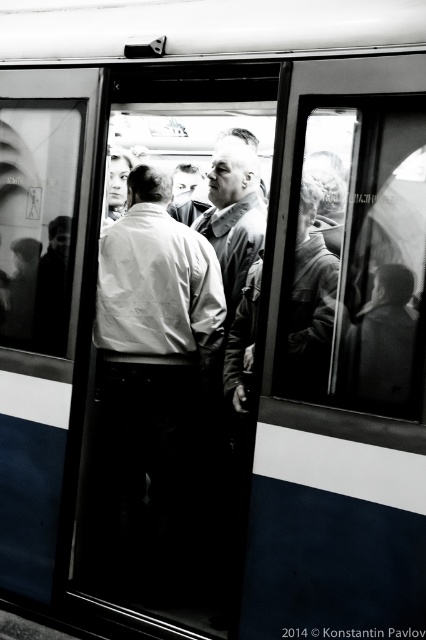
Question: Is white shirt at center above matte gray jacket at center?

Choices:
 (A) yes
 (B) no

Answer: (B)

Question: Which object is closer to the camera taking this photo?

Choices:
 (A) matte gray jacket at center
 (B) white shirt at center

Answer: (B)

Question: Which point is farther to the camera?

Choices:
 (A) (230, 188)
 (B) (166, 246)

Answer: (A)

Question: Which object appears closest to the camera in this image?

Choices:
 (A) white shirt at center
 (B) matte gray jacket at center

Answer: (A)

Question: Can you confirm if white shirt at center is bigger than matte gray jacket at center?

Choices:
 (A) yes
 (B) no

Answer: (A)

Question: Is white shirt at center below matte gray jacket at center?

Choices:
 (A) yes
 (B) no

Answer: (A)